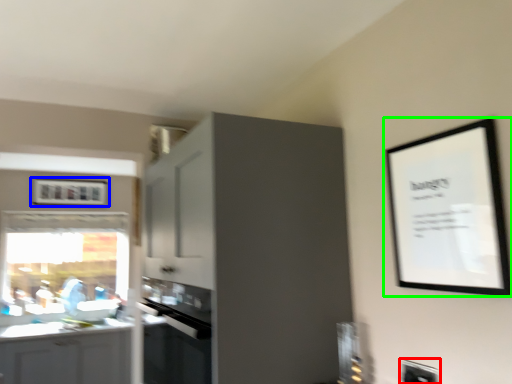
Question: Which object is the farthest from electric outlet (highlighted by a red box)? Choose among these: picture frame (highlighted by a blue box) or picture frame (highlighted by a green box).

Choices:
 (A) picture frame
 (B) picture frame

Answer: (A)